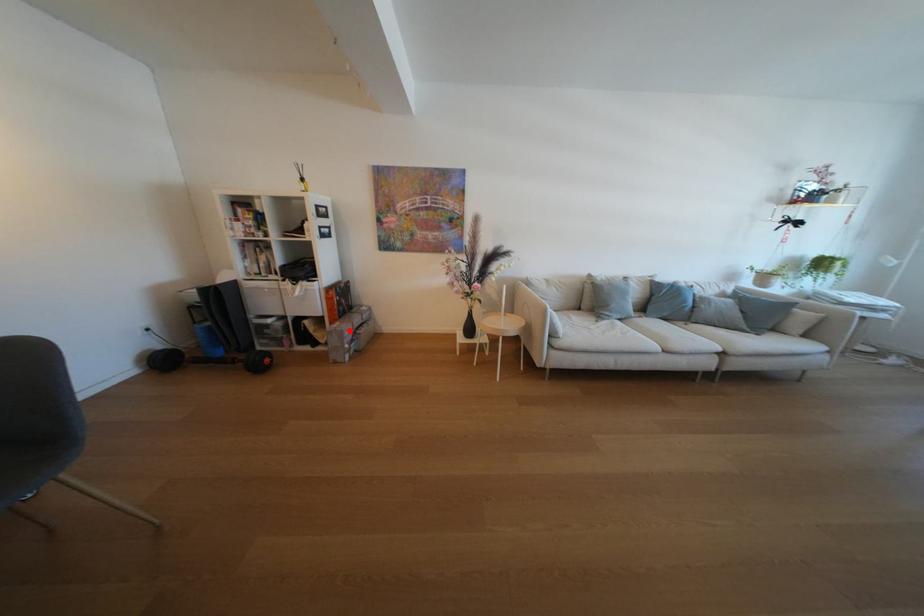
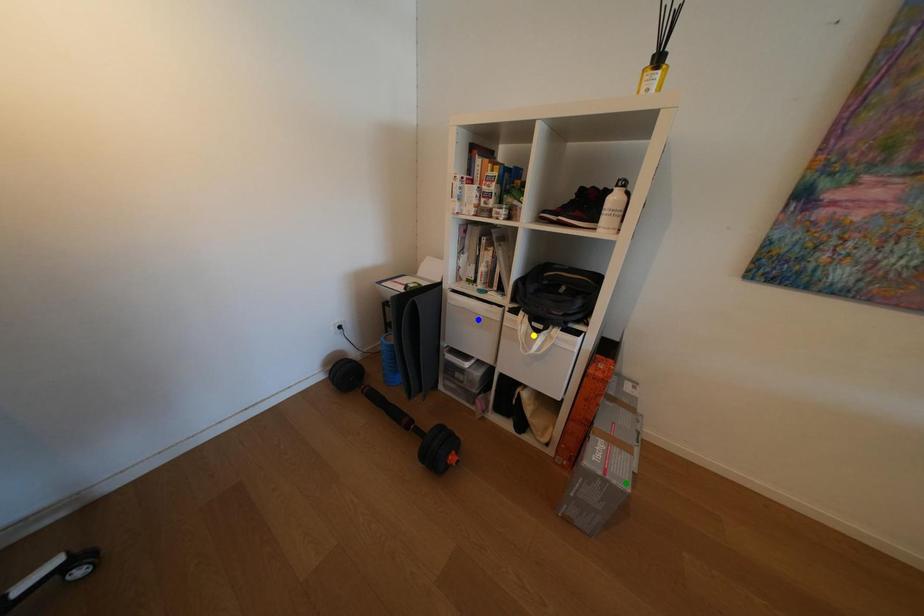
Question: I am providing you with two images of the same scene from different viewpoints. A red point is marked on the first image. You are given multiple points on the second image. Can you choose the point in image 2 that corresponds to the point in image 1?

Choices:
 (A) green point
 (B) blue point
 (C) yellow point

Answer: (A)